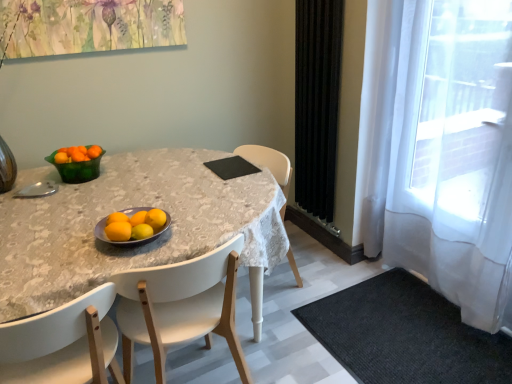
The height and width of the screenshot is (384, 512). What are the coordinates of `vacant space in front of black matte pad at center` in the screenshot? It's located at 234,180.